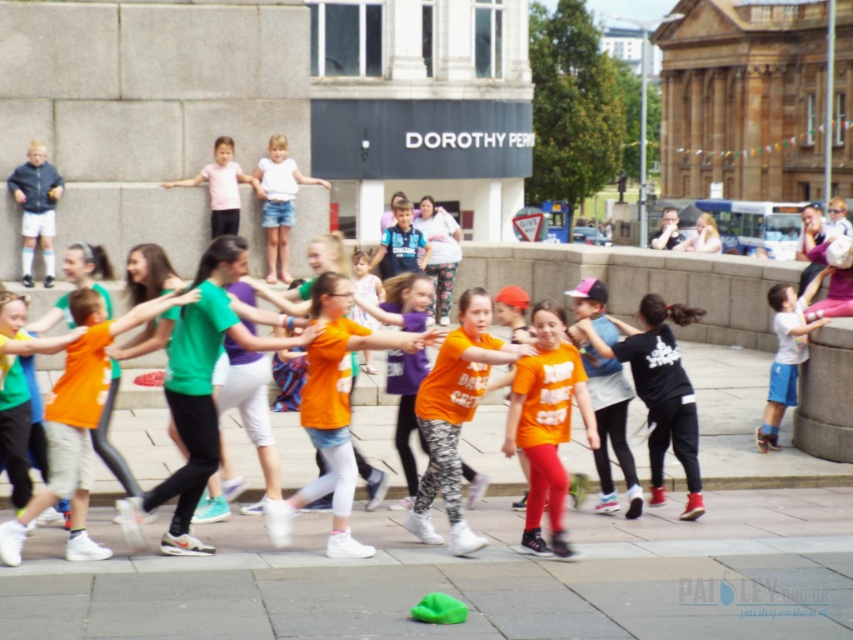
Can you confirm if white cotton shirt at center is wider than pink fabric shirt at upper center?

In fact, white cotton shirt at center might be narrower than pink fabric shirt at upper center.

Which is in front, point (796, 340) or point (221, 184)?

Point (796, 340)

Where is `white cotton shirt at center`? This screenshot has height=640, width=853. white cotton shirt at center is located at coordinates (786, 353).

Locate an element on the screen. The width and height of the screenshot is (853, 640). white cotton shirt at center is located at coordinates (786, 353).

Can you confirm if green fabric at lower center is bigger than black matte shirt at center?

No.

Does green fabric at lower center appear on the right side of black matte shirt at center?

Incorrect, green fabric at lower center is not on the right side of black matte shirt at center.

At what (x,y) coordinates should I click in order to perform the action: click on green fabric at lower center. Please return your answer as a coordinate pair (x, y). This screenshot has width=853, height=640. Looking at the image, I should click on (466, 577).

Is white cotton shirt at upper center shorter than pink fabric shirt at upper center?

In fact, white cotton shirt at upper center may be taller than pink fabric shirt at upper center.

Can you confirm if white cotton shirt at upper center is positioned above pink fabric shirt at upper center?

Actually, white cotton shirt at upper center is below pink fabric shirt at upper center.

Which is in front, point (268, 252) or point (219, 230)?

Point (219, 230) is in front.

Where is `white cotton shirt at upper center`? Image resolution: width=853 pixels, height=640 pixels. white cotton shirt at upper center is located at coordinates (279, 202).